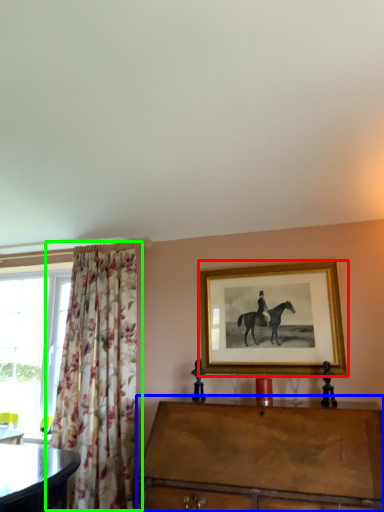
Question: Which object is the closest to the picture frame (highlighted by a red box)? Choose among these: chest of drawers (highlighted by a blue box) or curtain (highlighted by a green box).

Choices:
 (A) chest of drawers
 (B) curtain

Answer: (A)